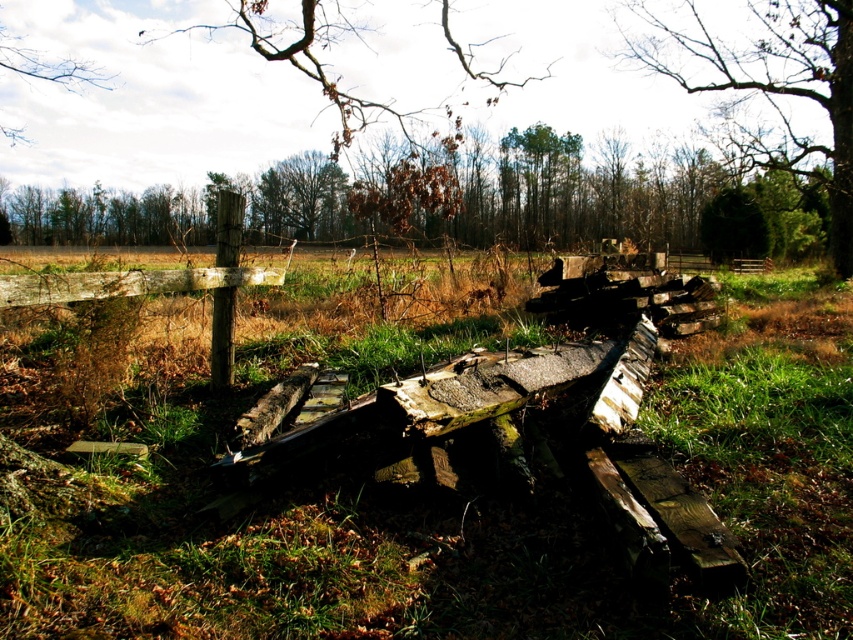
Which is below, green grass at center or brown leafy tree at upper center?

green grass at center is lower down.

How much distance is there between green grass at center and brown leafy tree at upper center?

The distance of green grass at center from brown leafy tree at upper center is 7.05 meters.

At what (x,y) coordinates should I click in order to perform the action: click on green grass at center. Please return your answer as a coordinate pair (x, y). The image size is (853, 640). Looking at the image, I should click on (427, 492).

Based on the photo, is the position of bare wood tree at upper center less distant than that of brown wood tree at upper left?

Yes, it is in front of brown wood tree at upper left.

Is point (809, 38) farther from viewer compared to point (0, 128)?

No, (809, 38) is in front of (0, 128).

You are a GUI agent. You are given a task and a screenshot of the screen. Output one action in this format:
    pyautogui.click(x=<x>, y=<y>)
    Task: Click on the bare wood tree at upper center
    
    Given the screenshot: What is the action you would take?
    pyautogui.click(x=776, y=86)

Is green grass at center closer to the viewer compared to brown wood tree at upper left?

Yes.

Who is more forward, [676,586] or [57,67]?

Positioned in front is point [676,586].

Identify the location of green grass at center. The image size is (853, 640). (427, 492).